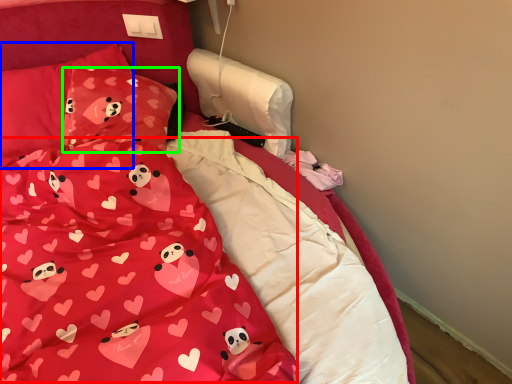
Question: Considering the real-world distances, which object is farthest from blanket (highlighted by a red box)? pillow (highlighted by a blue box) or pillow (highlighted by a green box)?

Choices:
 (A) pillow
 (B) pillow

Answer: (A)